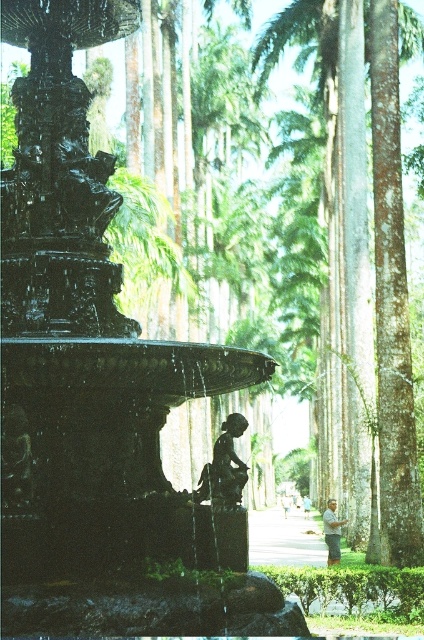
You are a landscape architect designing a garden. You have to place a new statue that is 2 meters wide between the shiny black fountain at center and the green textured palm tree at center. Which object should the statue be placed closer to so it fits better?

The shiny black fountain at center has a lesser width compared to the green textured palm tree at center. Therefore, the statue should be placed closer to the green textured palm tree at center to accommodate its 2 meters width.

Based on the photo, you are planning to place a new bench in the garden. The bench requires a space that is wider than the shiny black fountain at center. Is the area next to the light brown wood pole at lower right wide enough?

The shiny black fountain at center might be wider than light brown wood pole at lower right, so it is uncertain if the area next to the light brown wood pole at lower right is wide enough for the bench.

You are a photographer planning to capture both the shiny black fountain at center and the green textured palm tree at center in a single frame. Based on their heights, which one would appear taller in the photo?

The green textured palm tree at center appears taller in the photo because the shiny black fountain at center has a lesser height compared to it.